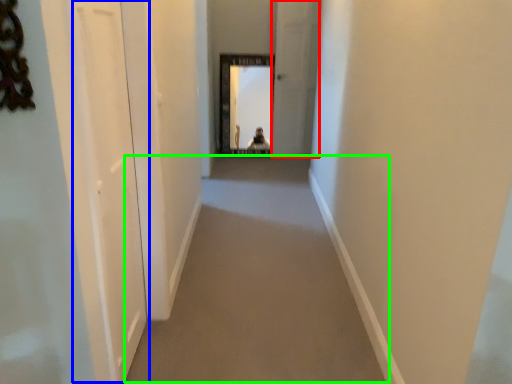
Question: Based on their relative distances, which object is nearer to screen door (highlighted by a red box)? Choose from screen door (highlighted by a blue box) and corridor (highlighted by a green box).

Choices:
 (A) screen door
 (B) corridor

Answer: (B)